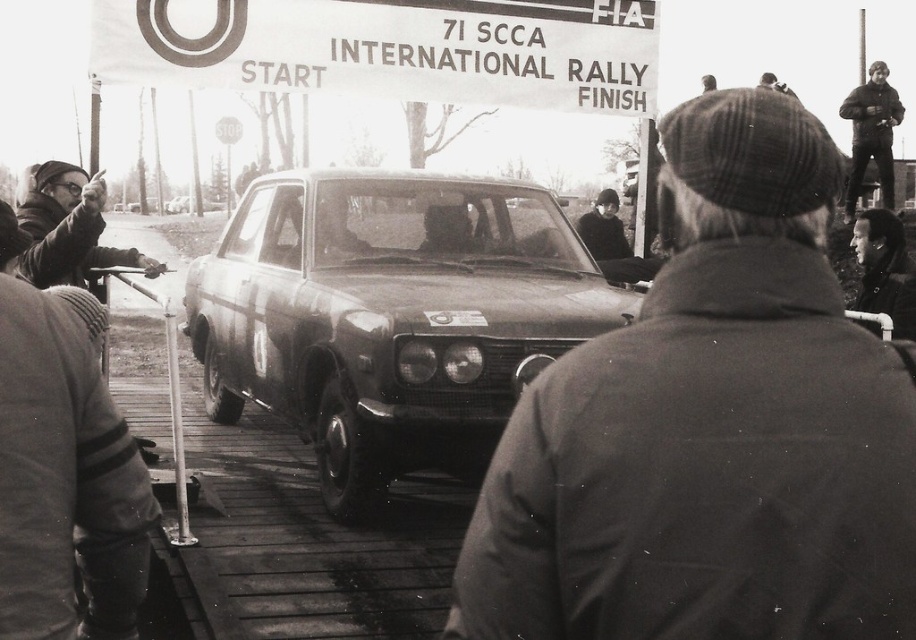
From the picture: You are a photographer at the 71 SCCA International Rally Finish. You notice two jackets in the scene. The dark brown leather jacket at upper right and the smooth black jacket at center. Which jacket is closer to the camera?

The dark brown leather jacket at upper right is closer to the camera because the smooth black jacket at center is behind it.

You are a photographer at the 71 SCCA International Rally Finish. You notice a coarse woolen cap at center and a metallic silver sedan at center in your viewfinder. Which object is positioned lower in the frame?

The coarse woolen cap at center is below the metallic silver sedan at center, so it is positioned lower in the frame.

From the picture: You are a photographer standing at the camera position in the image. You want to place a small sticker on the coarse woolen cap at center. The sticker requires a minimum of 4 feet of space to be applied properly. Can you apply the sticker from your current position?

The distance between the coarse woolen cap at center and the camera is 3.52 feet, which is less than the required 4 feet. Therefore, you cannot apply the sticker from your current position.